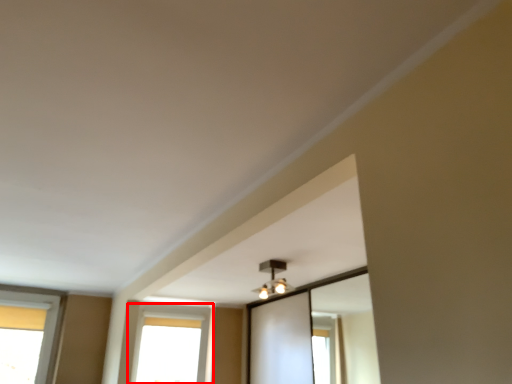
Question: Considering the relative positions of window (annotated by the red box) and light fixture in the image provided, where is window (annotated by the red box) located with respect to the staircase?

Choices:
 (A) left
 (B) right

Answer: (A)